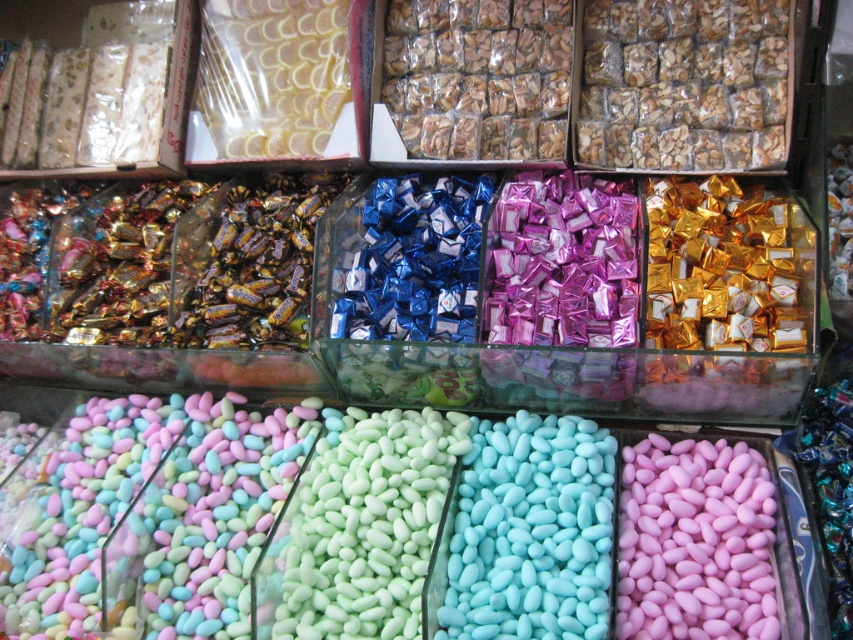
Question: Is blue matte candy at center below pink matte candy at lower right?

Choices:
 (A) no
 (B) yes

Answer: (A)

Question: Is blue matte candy at center to the left of pink matte candy at lower right from the viewer's perspective?

Choices:
 (A) no
 (B) yes

Answer: (B)

Question: Which point appears closest to the camera in this image?

Choices:
 (A) (506, 488)
 (B) (723, 451)

Answer: (A)

Question: Does blue matte candy at center appear on the left side of pink matte candy at lower right?

Choices:
 (A) yes
 (B) no

Answer: (A)